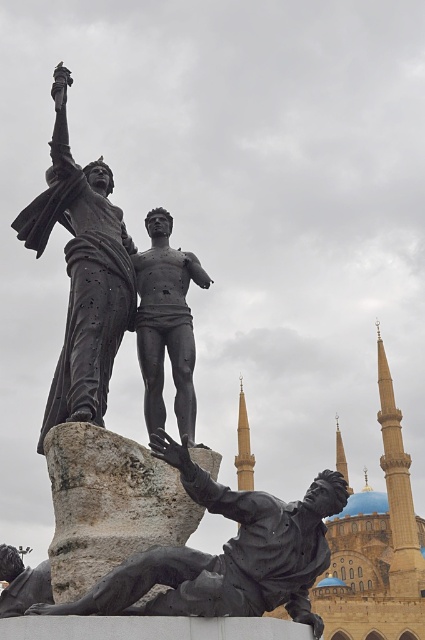
You are standing in front of the bronze sculpture and want to take a photo of the point at coordinates point [113,317]. If your camera has a focal length of 50mm and you are currently 20 meters away from the sculpture, should you move closer or farther away to focus on that point?

The point point [113,317] is 21.54 meters away from the viewer. Since you are currently 20 meters away, you should move slightly farther away to match the distance of 21.54 meters for proper focus.

You are an art student analyzing the sculpture composition. The bronze statue at lower center and the black polished statue at center are part of the same artwork. From your vantage point, which statue appears closer to you?

The bronze statue at lower center is in front of the black polished statue at center, so the bronze statue at lower center appears closer.

You are standing in front of the bronze sculpture and want to take a photo. You notice two points on the sculpture labeled as point (x=25, y=246) and point (x=147, y=385). Which point is closer to your camera lens?

Point (x=25, y=246) is further to the camera than point (x=147, y=385), so the point closer to the camera lens is point (x=147, y=385).